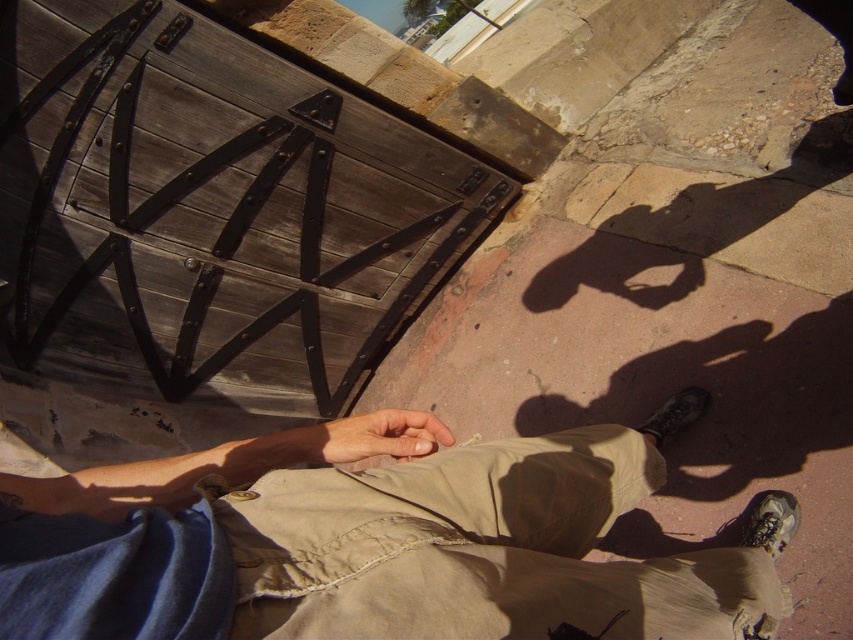
Does matte gray shoe at lower right appear on the right side of black leather shoe at lower right?

Correct, you'll find matte gray shoe at lower right to the right of black leather shoe at lower right.

Does point (788, 538) come in front of point (682, 396)?

Yes, point (788, 538) is closer to viewer.

Find the location of `matte gray shoe at lower right`. matte gray shoe at lower right is located at coordinates (770, 520).

Locate an element on the screen. The image size is (853, 640). matte gray shoe at lower right is located at coordinates (770, 520).

Does khaki cotton pants at lower center appear under black leather shoe at lower right?

Indeed, khaki cotton pants at lower center is positioned under black leather shoe at lower right.

Is khaki cotton pants at lower center smaller than black leather shoe at lower right?

Actually, khaki cotton pants at lower center might be larger than black leather shoe at lower right.

Measure the distance between khaki cotton pants at lower center and camera.

khaki cotton pants at lower center is 14.55 inches away from camera.

Find the location of a particular element. Image resolution: width=853 pixels, height=640 pixels. khaki cotton pants at lower center is located at coordinates (363, 547).

Where is `khaki cotton pants at lower center`? The width and height of the screenshot is (853, 640). khaki cotton pants at lower center is located at coordinates (363, 547).

Is khaki cotton pants at lower center shorter than matte gray shoe at lower right?

Incorrect, khaki cotton pants at lower center's height does not fall short of matte gray shoe at lower right's.

Who is more forward, (206, 467) or (762, 529)?

Positioned in front is point (206, 467).

The image size is (853, 640). I want to click on khaki cotton pants at lower center, so click(363, 547).